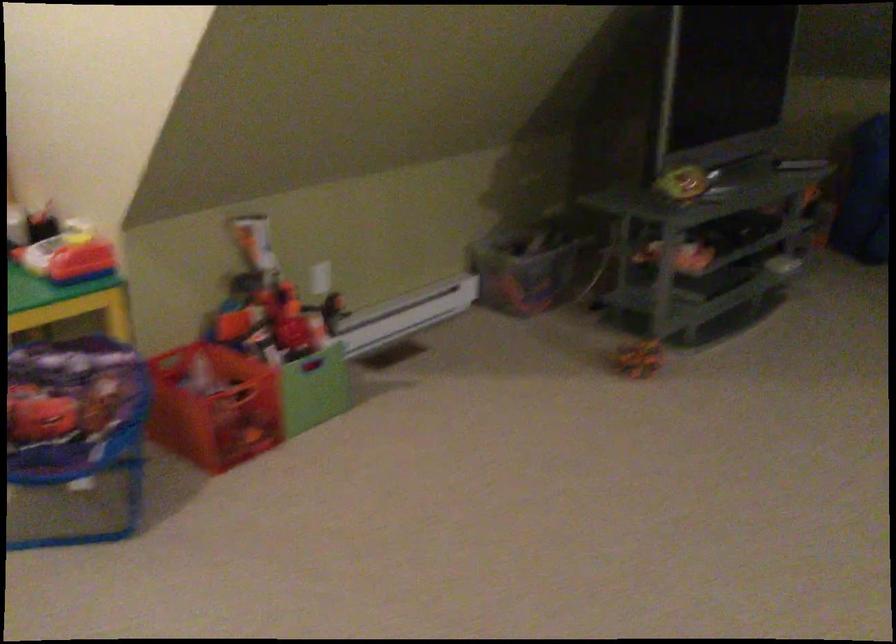
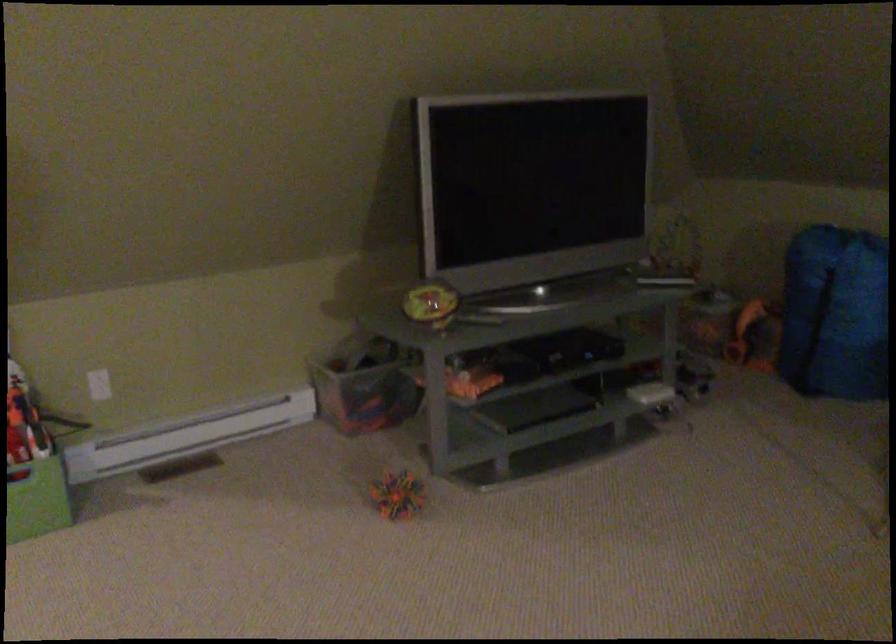
Question: In a continuous first-person perspective shot, in which direction is the camera moving?

Choices:
 (A) Left
 (B) Right
 (C) Forward
 (D) Backward

Answer: (B)